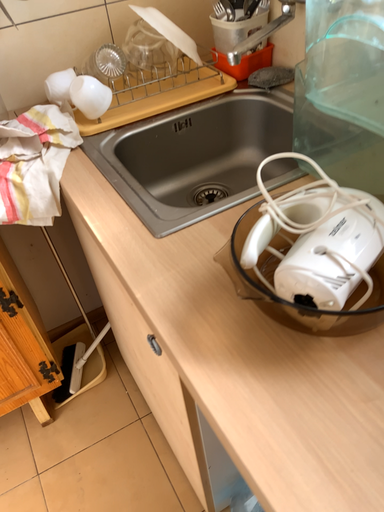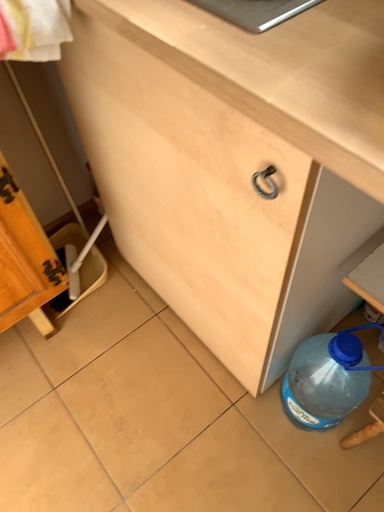
Question: Which way did the camera rotate in the video?

Choices:
 (A) rotated downward
 (B) rotated upward

Answer: (A)